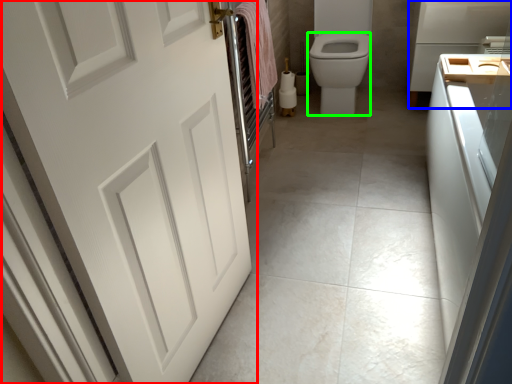
Question: Estimate the real-world distances between objects in this image. Which object is closer to door (highlighted by a red box), appliance (highlighted by a blue box) or bidet (highlighted by a green box)?

Choices:
 (A) appliance
 (B) bidet

Answer: (B)